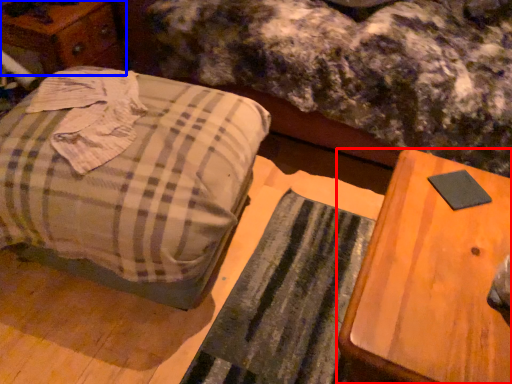
Question: Which object appears farthest to the camera in this image, table (highlighted by a red box) or dresser (highlighted by a blue box)?

Choices:
 (A) table
 (B) dresser

Answer: (B)